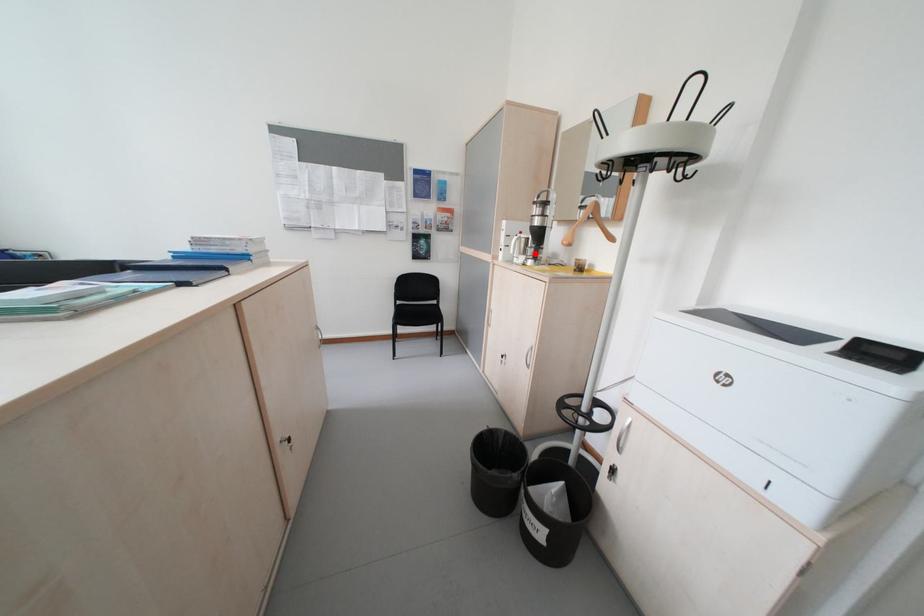
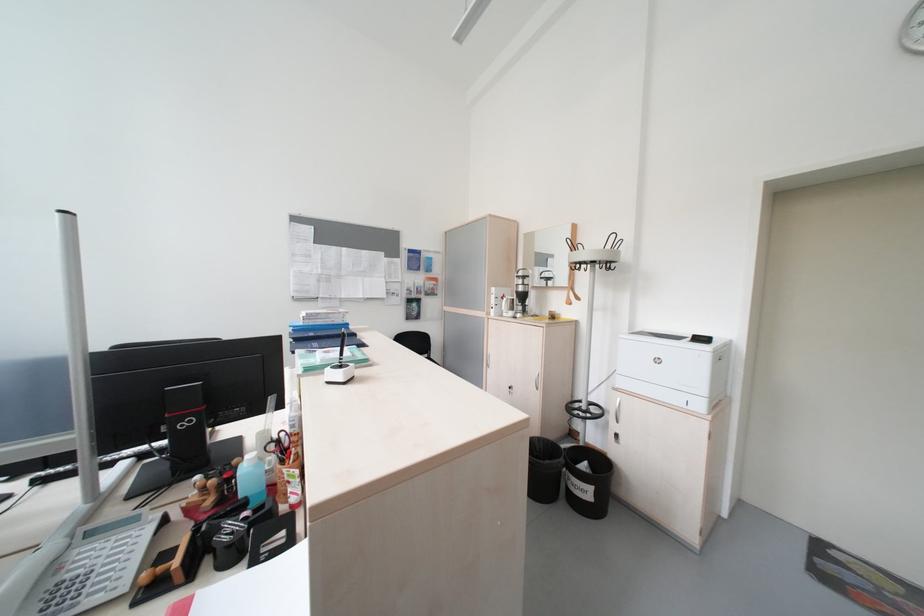
In the second image, find the point that corresponds to the highlighted location in the first image.

(523, 310)